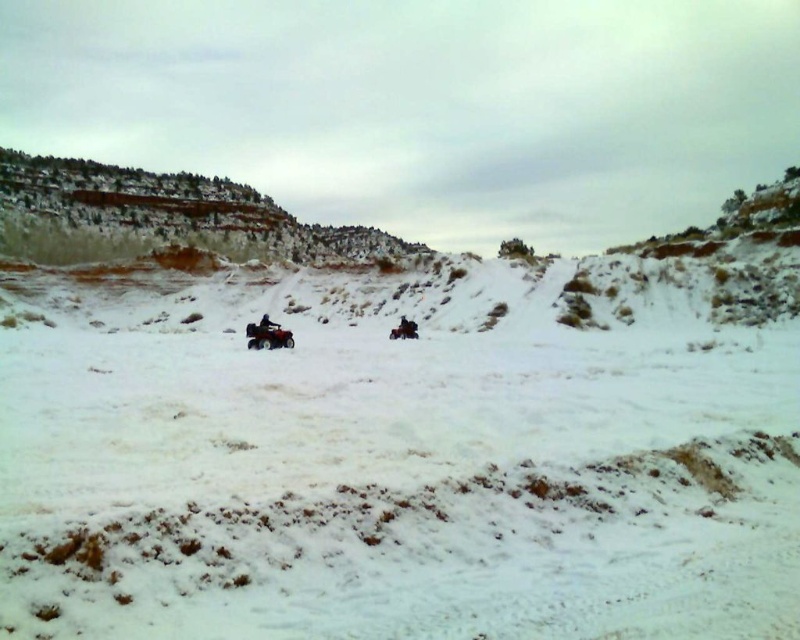
Looking at this image, you are an observer standing at the edge of the snowy terrain. You notice the rustic stone cliff at upper left and the blue fabric jacket at center. Which object is wider?

The rustic stone cliff at upper left is wider than the blue fabric jacket at center.

You are an observer standing at the edge of the snowy terrain. You see the matte red snowmobile at center and the blue fabric jacket at center. Which object is positioned lower in the image?

The matte red snowmobile at center is located below the blue fabric jacket at center, so it is positioned lower in the image.

You are an ATV rider planning to take a shortcut from the rustic stone cliff at upper left to the matte red snowmobile at center. Based on the scene, is the path between them clear of obstacles?

The rustic stone cliff at upper left is to the left of the matte red snowmobile at center, so the path between them is clear of obstacles as there are no objects mentioned blocking the way.